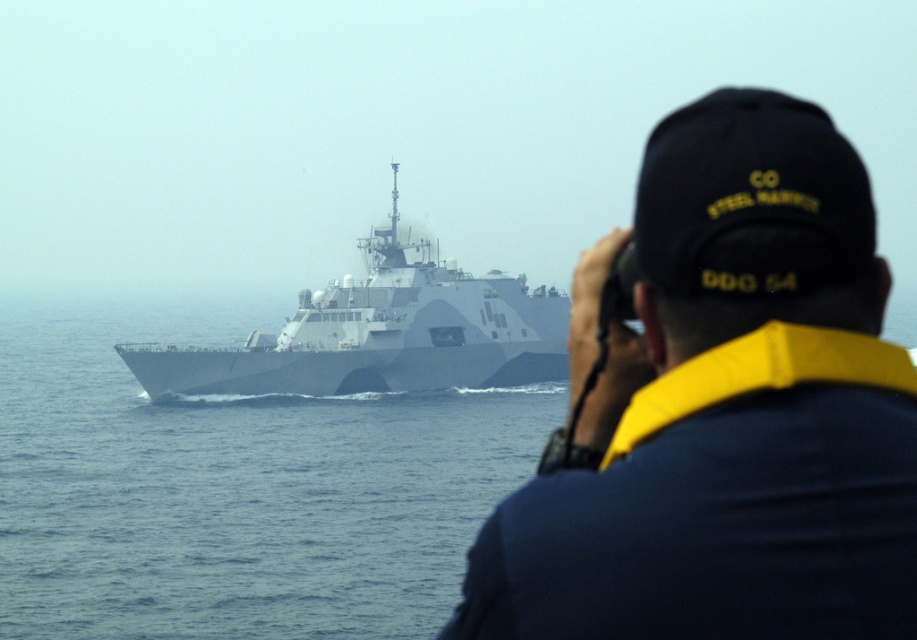
You are a photographer standing at point (739, 253). You need to take a photo of the USS Freedom naval ship. The camera you are holding has a maximum focus range of 7 meters. Will you be able to capture the ship clearly without moving?

The distance between point (739, 253) and the camera is 7.28 meters, which exceeds the camera maximum focus range of 7 meters. Therefore, you will not be able to capture the ship clearly without moving closer.

You are a photographer standing on the deck of the USS Freedom. You notice the gray matte water at center and the gray matte ship at center in your viewfinder. Which object is positioned lower in the frame?

The gray matte water at center is located below the gray matte ship at center, so it is positioned lower in the frame.